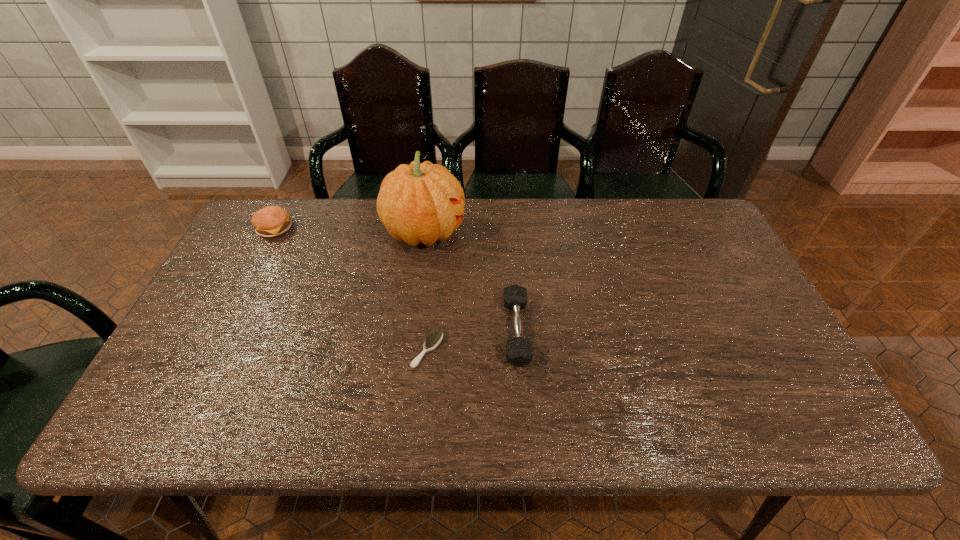
You are a GUI agent. You are given a task and a screenshot of the screen. Output one action in this format:
    pyautogui.click(x=<x>, y=<y>)
    Task: Click on the free spot between the leftmost object and the dumbbell
    
    Given the screenshot: What is the action you would take?
    pyautogui.click(x=396, y=279)

Identify the location of empty location between the pumpkin and the leftmost object. (349, 230).

You are a GUI agent. You are given a task and a screenshot of the screen. Output one action in this format:
    pyautogui.click(x=<x>, y=<y>)
    Task: Click on the vacant area between the leftmost object and the shortest object
    
    Given the screenshot: What is the action you would take?
    pyautogui.click(x=350, y=289)

The width and height of the screenshot is (960, 540). What are the coordinates of `free point between the hamburger and the rightmost object` in the screenshot? It's located at (396, 279).

Where is `vacant point located between the shortest object and the tallest object`? vacant point located between the shortest object and the tallest object is located at coordinates (426, 291).

Find the location of a particular element. This screenshot has width=960, height=540. vacant space in between the scrubbing brush and the leftmost object is located at coordinates (350, 289).

Where is `free space between the shortest object and the hamburger`? free space between the shortest object and the hamburger is located at coordinates coord(350,289).

The height and width of the screenshot is (540, 960). What are the coordinates of `vacant area between the hamburger and the pumpkin` in the screenshot? It's located at (349, 230).

Locate an element on the screen. The width and height of the screenshot is (960, 540). vacant region between the tallest object and the shortest object is located at coordinates (426, 291).

Choose which object is the nearest neighbor to the shortest object. Please provide its 2D coordinates. Your answer should be formatted as a tuple, i.e. [(x, y)], where the tuple contains the x and y coordinates of a point satisfying the conditions above.

[(519, 352)]